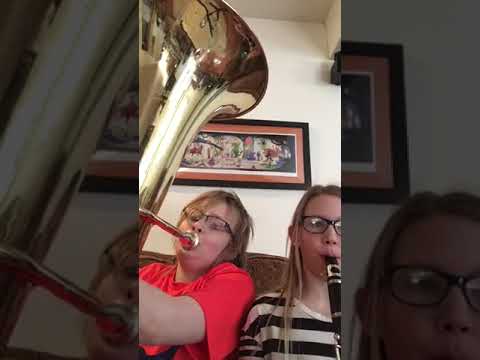
I want to click on below picture frame, so click(344, 208), click(368, 208), click(398, 206), click(174, 184), click(208, 185), click(244, 188), click(272, 188), click(296, 187).